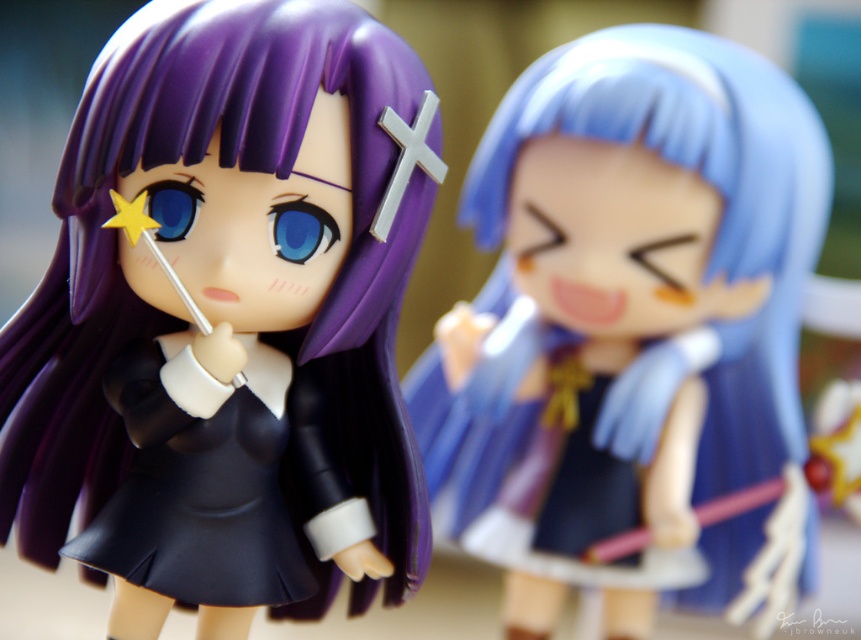
Can you confirm if matte black dress at center is taller than satin blue dress at right?

No, matte black dress at center is not taller than satin blue dress at right.

Does matte black dress at center appear on the left side of satin blue dress at right?

Correct, you'll find matte black dress at center to the left of satin blue dress at right.

Does point (98, 420) come closer to viewer compared to point (776, 458)?

That is True.

The height and width of the screenshot is (640, 861). In order to click on matte black dress at center in this screenshot , I will do `click(225, 323)`.

Can you confirm if satin blue dress at right is smaller than black matte/satin school uniform at center?

No.

Is point (732, 182) behind point (189, 429)?

Yes.

Between point (633, 58) and point (159, 509), which one is positioned behind?

The point (633, 58) is behind.

Find the location of a particular element. The height and width of the screenshot is (640, 861). satin blue dress at right is located at coordinates (626, 292).

Who is more forward, (372, 540) or (214, 577)?

Point (214, 577)

Does matte black dress at center come behind black matte/satin school uniform at center?

No, it is in front of black matte/satin school uniform at center.

Which is behind, point (320, 296) or point (118, 384)?

Point (118, 384)

Identify the location of matte black dress at center. (225, 323).